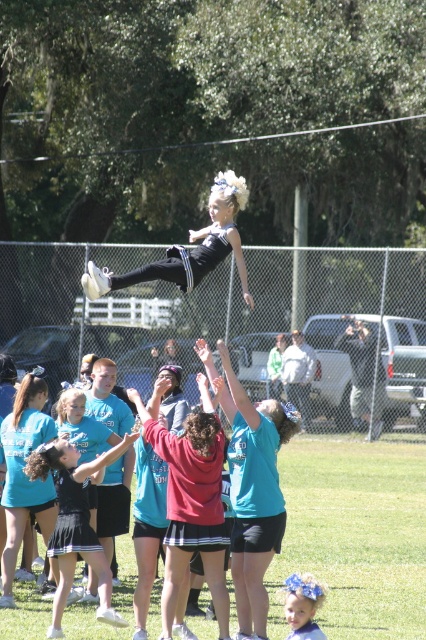
Question: Can you confirm if green grass football field at center is positioned to the right of black matte leotard at center?

Choices:
 (A) yes
 (B) no

Answer: (A)

Question: Considering the relative positions of green grass football field at center and black matte leotard at center in the image provided, where is green grass football field at center located with respect to black matte leotard at center?

Choices:
 (A) above
 (B) below

Answer: (B)

Question: Among these points, which one is nearest to the camera?

Choices:
 (A) (386, 531)
 (B) (155, 276)

Answer: (B)

Question: Does green grass football field at center appear over black matte leotard at center?

Choices:
 (A) yes
 (B) no

Answer: (B)

Question: Which point is farther to the camera?

Choices:
 (A) black matte leotard at center
 (B) green grass football field at center

Answer: (A)